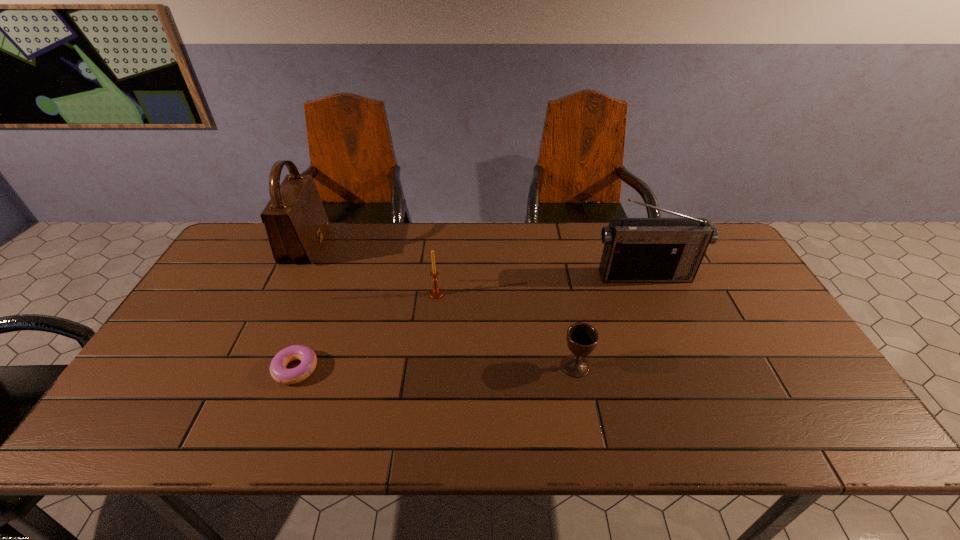
You are a GUI agent. You are given a task and a screenshot of the screen. Output one action in this format:
    pyautogui.click(x=<x>, y=<y>)
    Task: Click on the object identified as the second closest to the fourth object from left to right
    The image size is (960, 540).
    Given the screenshot: What is the action you would take?
    pyautogui.click(x=436, y=293)

The image size is (960, 540). Identify the location of object that is the closest to the rightmost object. (582, 338).

Where is `vacant space that satisfies the following two spatial constraints: 1. on the front flap of the leftmost object; 2. on the right side of the third farthest object`? vacant space that satisfies the following two spatial constraints: 1. on the front flap of the leftmost object; 2. on the right side of the third farthest object is located at coordinates point(282,294).

This screenshot has height=540, width=960. I want to click on blank area in the image that satisfies the following two spatial constraints: 1. on the front flap of the third object from right to left; 2. on the right side of the shoulder bag, so click(282, 294).

Locate an element on the screen. This screenshot has width=960, height=540. vacant space that satisfies the following two spatial constraints: 1. on the front flap of the candle_holder; 2. on the right side of the leftmost object is located at coordinates point(282,294).

I want to click on free space that satisfies the following two spatial constraints: 1. on the back side of the third object from right to left; 2. on the front flap of the leftmost object, so click(442, 245).

You are a GUI agent. You are given a task and a screenshot of the screen. Output one action in this format:
    pyautogui.click(x=<x>, y=<y>)
    Task: Click on the blank area in the image that satisfies the following two spatial constraints: 1. on the front flap of the leftmost object; 2. on the back side of the third object from right to left
    
    Given the screenshot: What is the action you would take?
    pyautogui.click(x=282, y=294)